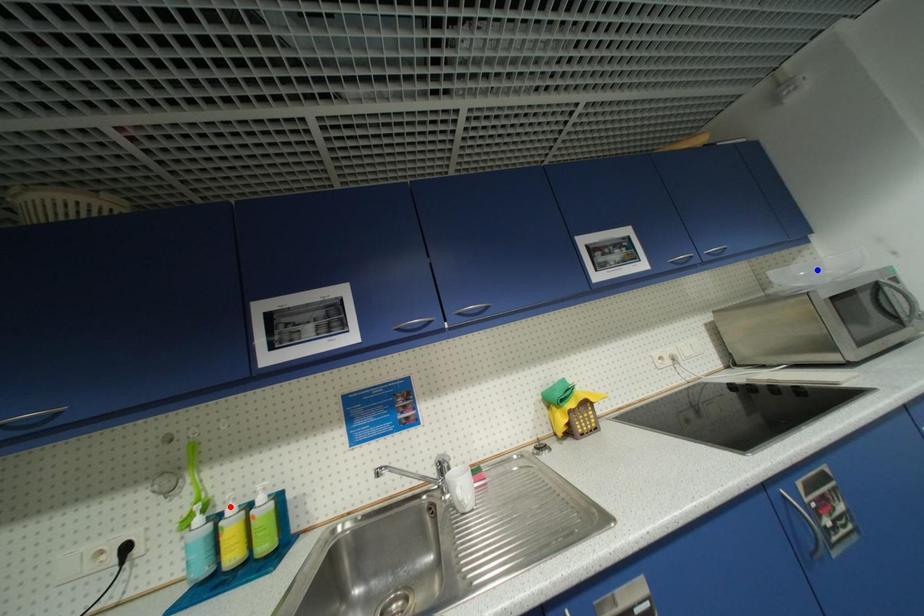
Question: Which of the two points in the image is closer to the camera?

Choices:
 (A) Blue point is closer.
 (B) Red point is closer.

Answer: (B)